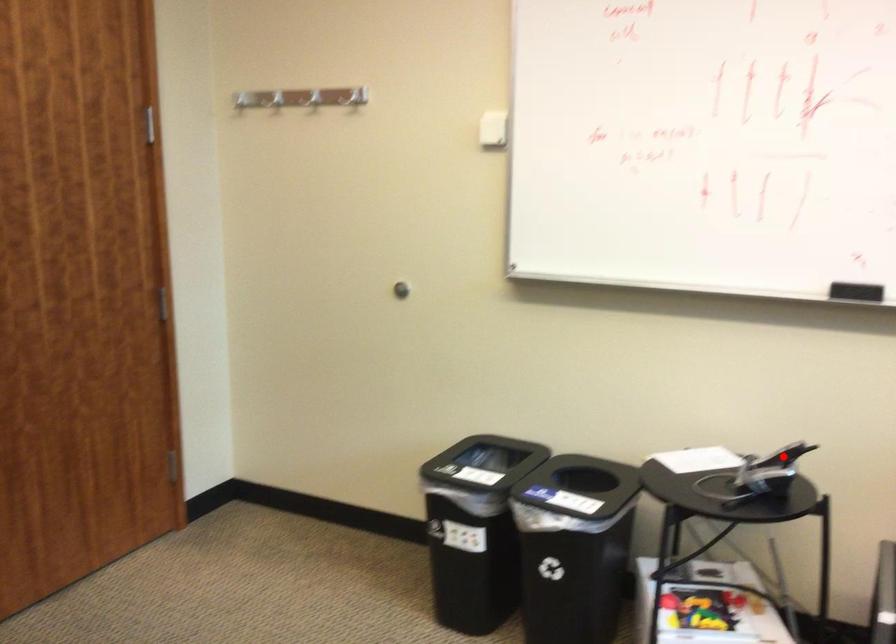
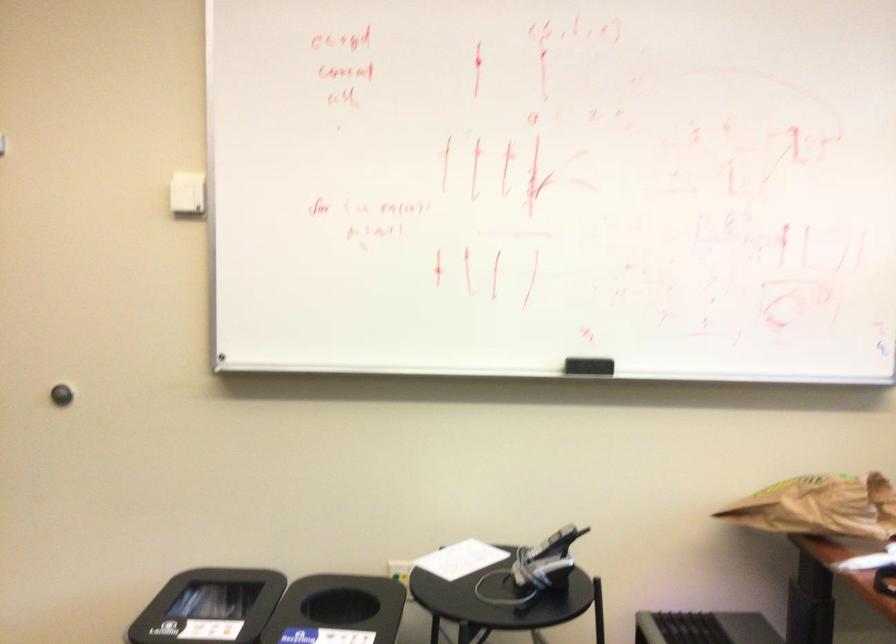
Locate, in the second image, the point that corresponds to the highlighted location in the first image.

(552, 544)